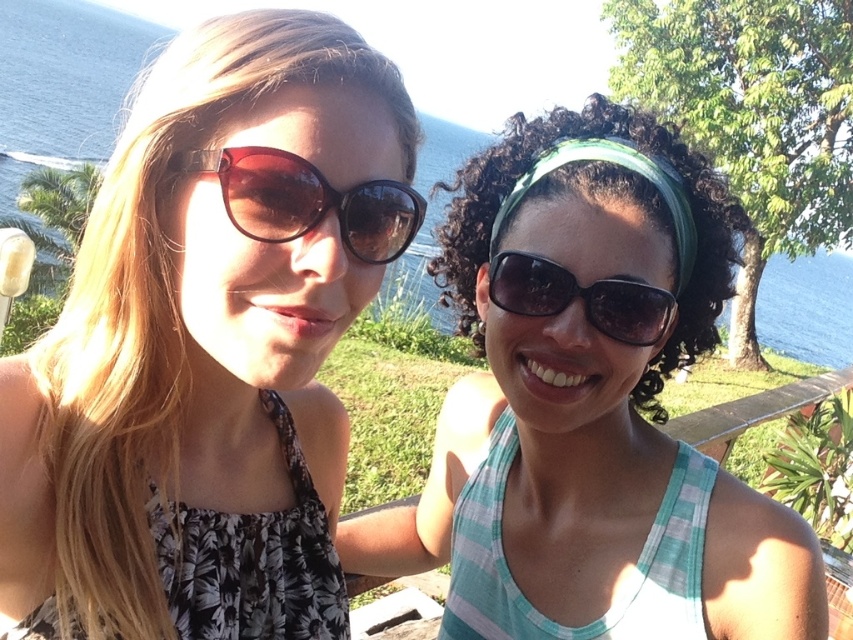
Question: Does matte black sunglasses at left appear over green plaid tank top at center?

Choices:
 (A) yes
 (B) no

Answer: (A)

Question: Considering the relative positions of matte black sunglasses at left and sunglasses at center in the image provided, where is matte black sunglasses at left located with respect to sunglasses at center?

Choices:
 (A) left
 (B) right

Answer: (A)

Question: Which of the following is the farthest from the observer?

Choices:
 (A) matte black sunglasses at left
 (B) green plaid tank top at center

Answer: (B)

Question: Which point is closer to the camera?

Choices:
 (A) pos(292,214)
 (B) pos(83,413)
 (C) pos(473,593)

Answer: (A)

Question: In this image, where is matte black sunglasses at left located relative to sunglasses at center?

Choices:
 (A) right
 (B) left

Answer: (B)

Question: Which is nearer to the sunglasses at center?

Choices:
 (A) green plaid tank top at center
 (B) brown glossy sunglasses at left
 (C) matte black sunglasses at left

Answer: (B)